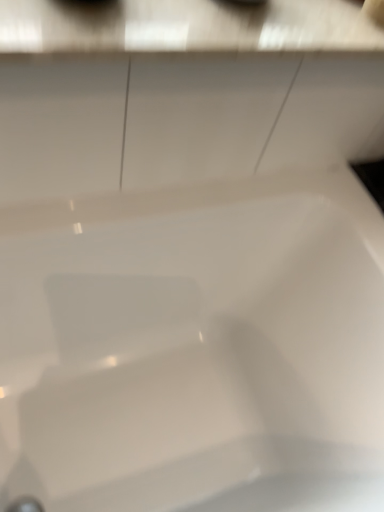
Describe the element at coordinates (195, 348) in the screenshot. The width and height of the screenshot is (384, 512). I see `white glossy bathtub at center` at that location.

You are a GUI agent. You are given a task and a screenshot of the screen. Output one action in this format:
    pyautogui.click(x=<x>, y=<y>)
    Task: Click on the white glossy bathtub at center
    
    Given the screenshot: What is the action you would take?
    pyautogui.click(x=195, y=348)

At what (x,y) coordinates should I click in order to perform the action: click on white glossy bathtub at center. Please return your answer as a coordinate pair (x, y). The width and height of the screenshot is (384, 512). Looking at the image, I should click on (195, 348).